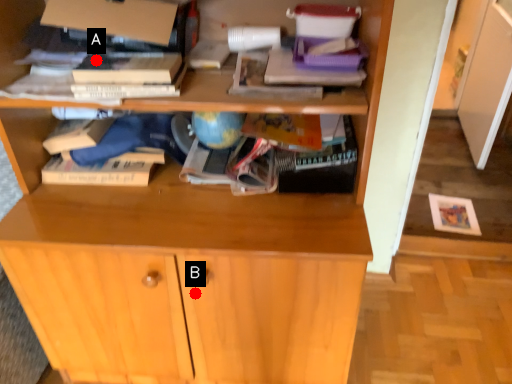
Question: Two points are circled on the image, labeled by A and B beside each circle. Among these points, which one is farthest from the camera?

Choices:
 (A) A is further
 (B) B is further

Answer: (B)